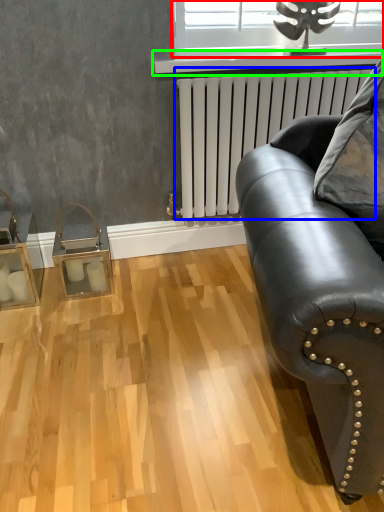
Question: Which object is positioned farthest from window (highlighted by a red box)? Select from radiator (highlighted by a blue box) and window sill (highlighted by a green box).

Choices:
 (A) radiator
 (B) window sill

Answer: (A)